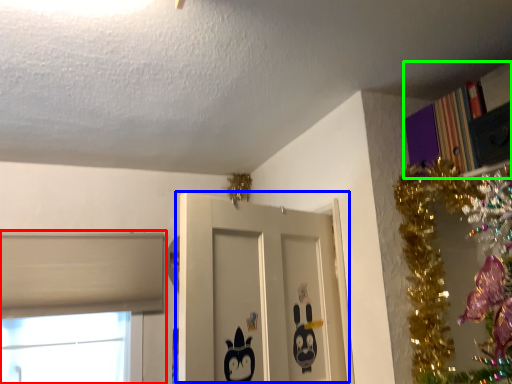
Question: Which is farther away from window (highlighted by a red box)? door (highlighted by a blue box) or bookcase (highlighted by a green box)?

Choices:
 (A) door
 (B) bookcase

Answer: (B)